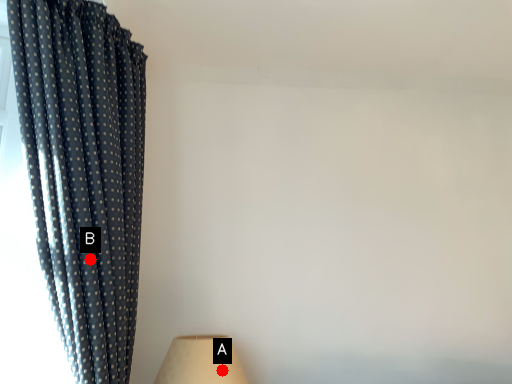
Question: Two points are circled on the image, labeled by A and B beside each circle. Which point is farther from the camera taking this photo?

Choices:
 (A) A is further
 (B) B is further

Answer: (A)